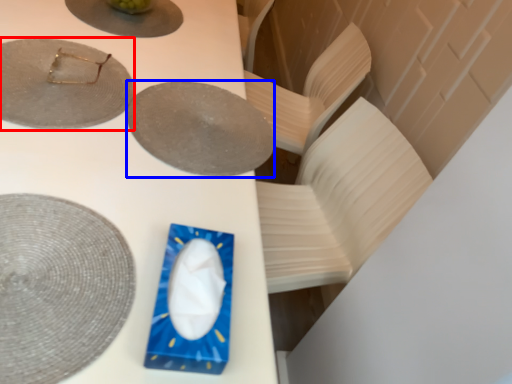
Question: Which object appears farthest to the camera in this image, plate (highlighted by a red box) or plate (highlighted by a blue box)?

Choices:
 (A) plate
 (B) plate

Answer: (B)